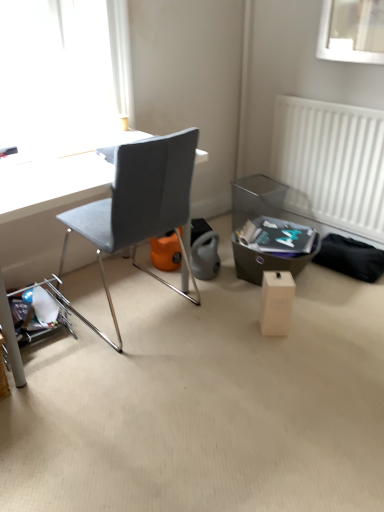
Question: Is point (322, 166) positioned closer to the camera than point (266, 279)?

Choices:
 (A) closer
 (B) farther

Answer: (B)

Question: In the image, is white plastic radiator at right on the left side or the right side of white cardboard box at center?

Choices:
 (A) right
 (B) left

Answer: (A)

Question: Which is farther from the white cardboard box at center?

Choices:
 (A) matte gray chair at center
 (B) white plastic radiator at right

Answer: (B)

Question: Based on their relative distances, which object is nearer to the matte gray chair at center?

Choices:
 (A) white cardboard box at center
 (B) white plastic radiator at right

Answer: (A)